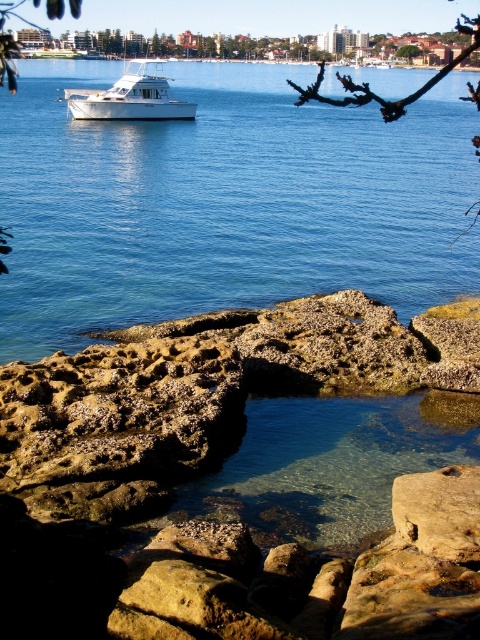
You are standing on the rocky shoreline and want to take a photo of the brown rough rock at lower right and the green leafy tree at upper center. Which object should you point your camera towards first if you want to capture both in a single frame without moving the camera?

You should point your camera towards the brown rough rock at lower right first because it is positioned on the left side of the green leafy tree at upper center, so capturing the left side first will include both objects in the frame.

You are standing at the edge of the rocky shoreline in the coastal scene. You notice a point marked at coordinates (440,512). What object is located at that point?

The point at coordinates (440,512) indicates a brown rough rock at lower right.

You are a marine biologist who needs to collect samples from the brown rough rock at lower right and the white matte boat at upper left. Given that your sample collection device has a maximum range of 40 meters, can you reach both locations from your current position near the boat without moving closer?

The brown rough rock at lower right is 39.51 meters from the white matte boat at upper left. Since the distance is within the 40 meters range of your device, you can collect samples from both locations without moving closer.